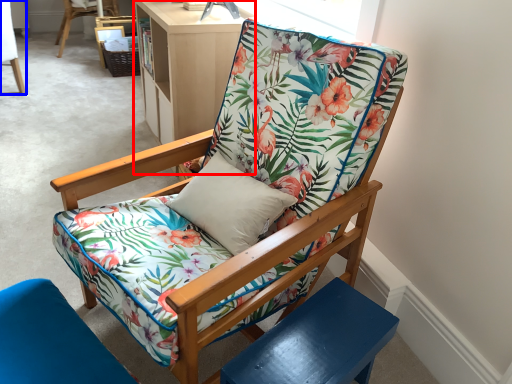
Question: Which object is closer to the camera taking this photo, bookshelf (highlighted by a red box) or chair (highlighted by a blue box)?

Choices:
 (A) bookshelf
 (B) chair

Answer: (A)